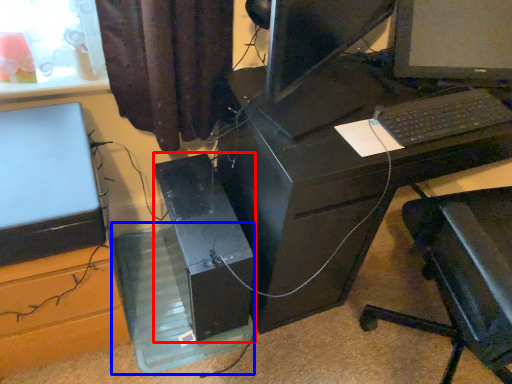
Question: Which object appears farthest to the camera in this image, computer tower (highlighted by a red box) or glass box (highlighted by a blue box)?

Choices:
 (A) computer tower
 (B) glass box

Answer: (B)